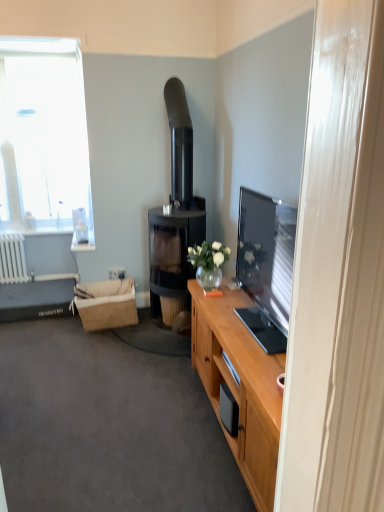
Question: From the image's perspective, is black glass fireplace at center beneath white glass window at upper left?

Choices:
 (A) yes
 (B) no

Answer: (A)

Question: Is black glass fireplace at center at the right side of white glass window at upper left?

Choices:
 (A) no
 (B) yes

Answer: (B)

Question: Does black glass fireplace at center have a lesser height compared to white glass window at upper left?

Choices:
 (A) yes
 (B) no

Answer: (B)

Question: Is black glass fireplace at center at the left side of white glass window at upper left?

Choices:
 (A) yes
 (B) no

Answer: (B)

Question: Does black glass fireplace at center turn towards white glass window at upper left?

Choices:
 (A) no
 (B) yes

Answer: (A)

Question: From a real-world perspective, is black glass fireplace at center positioned under white glass window at upper left based on gravity?

Choices:
 (A) yes
 (B) no

Answer: (A)

Question: Is white plastic power outlet at lower left positioned before black glass fireplace at center?

Choices:
 (A) yes
 (B) no

Answer: (B)

Question: Is white plastic power outlet at lower left at the left side of black glass fireplace at center?

Choices:
 (A) yes
 (B) no

Answer: (A)

Question: Considering the relative sizes of white plastic power outlet at lower left and black glass fireplace at center in the image provided, is white plastic power outlet at lower left thinner than black glass fireplace at center?

Choices:
 (A) no
 (B) yes

Answer: (B)

Question: Are white plastic power outlet at lower left and black glass fireplace at center making contact?

Choices:
 (A) yes
 (B) no

Answer: (B)

Question: From the image's perspective, is white plastic power outlet at lower left beneath black glass fireplace at center?

Choices:
 (A) yes
 (B) no

Answer: (A)

Question: Is white plastic power outlet at lower left oriented towards black glass fireplace at center?

Choices:
 (A) no
 (B) yes

Answer: (A)

Question: Is white glass window at upper left turned away from white plastic power outlet at lower left?

Choices:
 (A) yes
 (B) no

Answer: (B)